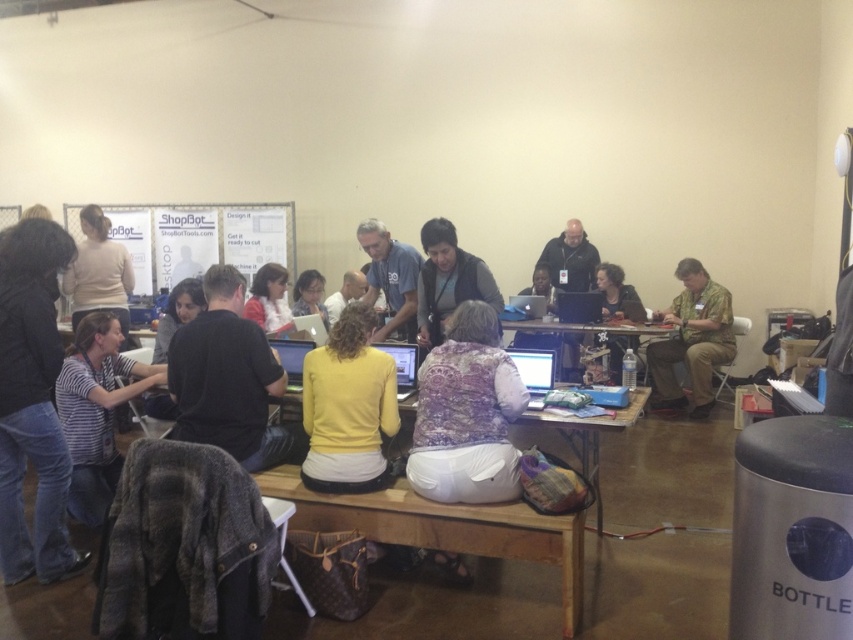
You are organizing a workshop and need to place a name tag for the person wearing the yellow matte sweater at center and the striped fabric shirt at lower left. If you want to place the name tags from left to right in the order they are positioned in the image, which order should you arrange them?

The striped fabric shirt at lower left is positioned to the left of the yellow matte sweater at center, so the name tags should be arranged from left to right as striped fabric shirt at lower left first, followed by yellow matte sweater at center.

You are a photographer trying to capture a clear shot of the yellow matte sweater at center and the striped fabric shirt at lower left. Since you want both subjects to be in focus, which one should you position closer to the camera to ensure depth of field?

The yellow matte sweater at center is in front of the striped fabric shirt at lower left, so to ensure both are in focus, you should position the yellow matte sweater at center closer to the camera.